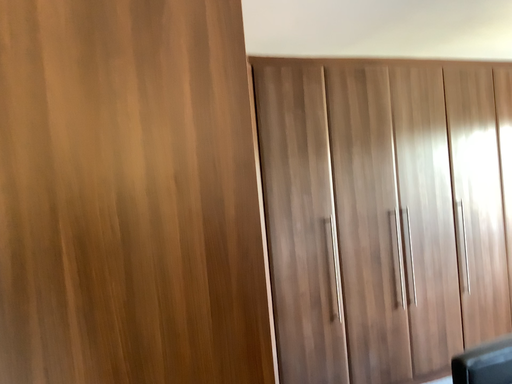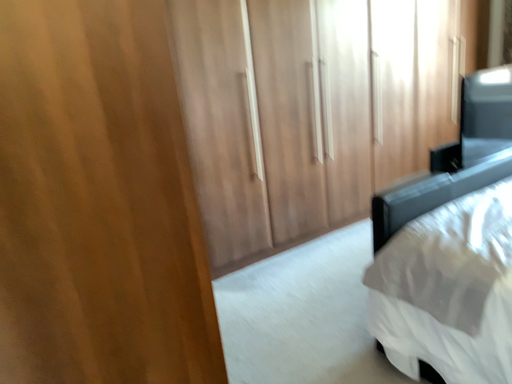
Question: Which way did the camera rotate in the video?

Choices:
 (A) rotated left
 (B) rotated right

Answer: (B)